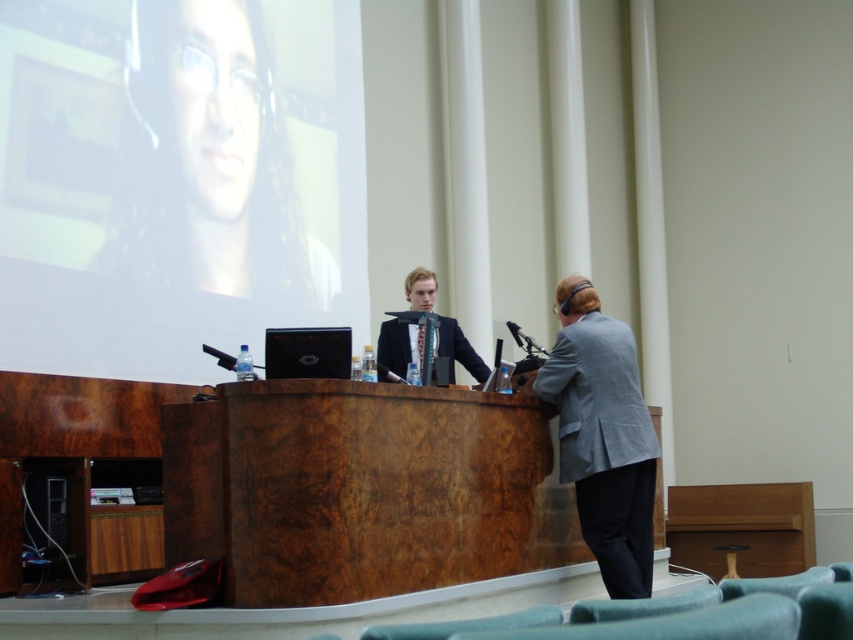
Which is above, matte black laptop at upper left or gray wool suit at right?

matte black laptop at upper left is higher up.

Which is more to the left, matte black laptop at upper left or gray wool suit at right?

matte black laptop at upper left is more to the left.

Describe the element at coordinates (210, 163) in the screenshot. I see `matte black laptop at upper left` at that location.

Locate an element on the screen. matte black laptop at upper left is located at coordinates (210, 163).

Is gray wool suit at right smaller than dark gray fabric business suit at center?

Actually, gray wool suit at right might be larger than dark gray fabric business suit at center.

Is gray wool suit at right further to the viewer compared to dark gray fabric business suit at center?

That is False.

The height and width of the screenshot is (640, 853). I want to click on gray wool suit at right, so click(604, 444).

Find the location of `gray wool suit at right`. gray wool suit at right is located at coordinates (604, 444).

Does matte black laptop at upper left appear on the left side of dark gray fabric business suit at center?

Indeed, matte black laptop at upper left is positioned on the left side of dark gray fabric business suit at center.

Which is in front, point (160, 58) or point (457, 346)?

Point (457, 346)

The height and width of the screenshot is (640, 853). I want to click on matte black laptop at upper left, so click(210, 163).